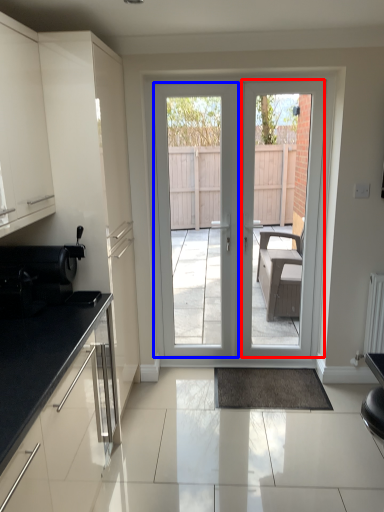
Question: Which point is closer to the camera, screen door (highlighted by a red box) or screen door (highlighted by a blue box)?

Choices:
 (A) screen door
 (B) screen door

Answer: (A)